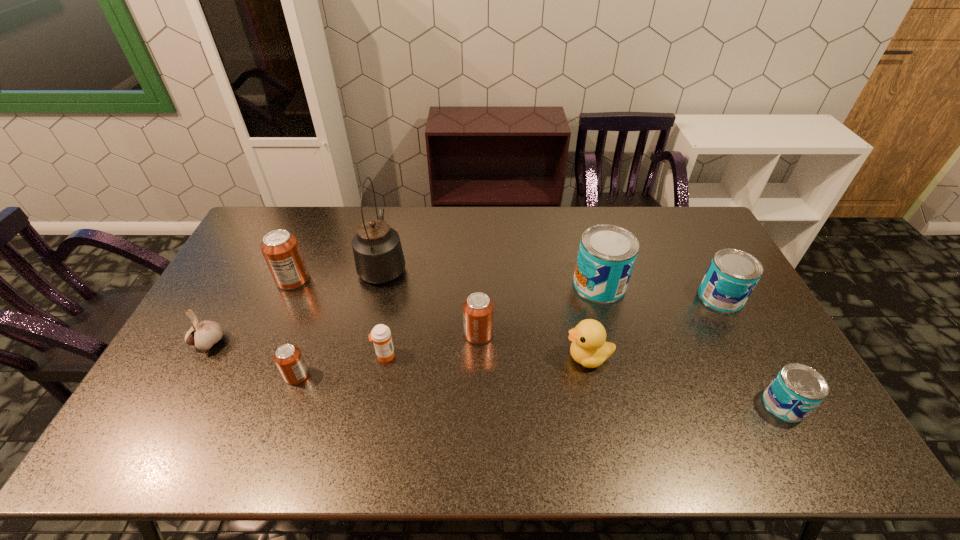
The height and width of the screenshot is (540, 960). I want to click on free space between the second biggest blue can and the kettle, so click(x=552, y=281).

In order to click on free spot between the second farthest orange can and the nearest can in this screenshot , I will do `click(632, 369)`.

Select which object appears as the ninth closest to the biggest blue can. Please provide its 2D coordinates. Your answer should be formatted as a tuple, i.e. [(x, y)], where the tuple contains the x and y coordinates of a point satisfying the conditions above.

[(203, 335)]

Image resolution: width=960 pixels, height=540 pixels. In order to click on object that is the seventh closest to the leftmost can in this screenshot , I will do `click(607, 253)`.

I want to click on the third closest can to the nearest orange can, so click(607, 253).

Point out which can is positioned as the second nearest to the garlic. Please provide its 2D coordinates. Your answer should be formatted as a tuple, i.e. [(x, y)], where the tuple contains the x and y coordinates of a point satisfying the conditions above.

[(288, 358)]

Select which blue can appears as the second closest to the medicine. Please provide its 2D coordinates. Your answer should be formatted as a tuple, i.e. [(x, y)], where the tuple contains the x and y coordinates of a point satisfying the conditions above.

[(732, 275)]

Where is `blue can that is the closest to the biggest blue can`? blue can that is the closest to the biggest blue can is located at coordinates (732, 275).

The image size is (960, 540). In order to click on orange can that stands as the closest to the medicine in this screenshot , I will do `click(288, 358)`.

Select which orange can appears as the second closest to the garlic. Please provide its 2D coordinates. Your answer should be formatted as a tuple, i.e. [(x, y)], where the tuple contains the x and y coordinates of a point satisfying the conditions above.

[(288, 358)]